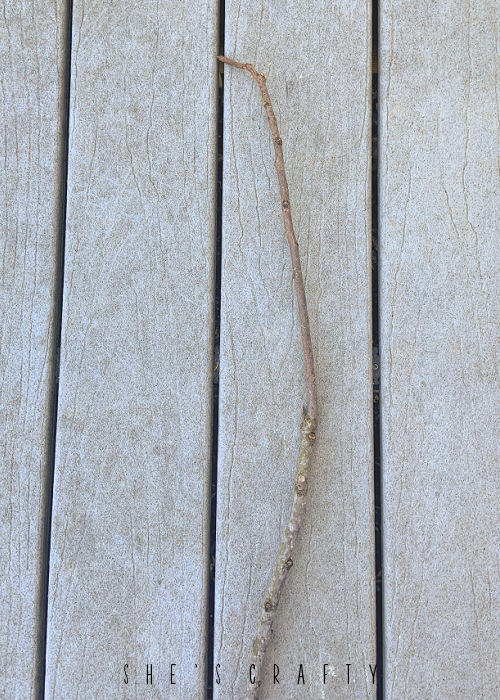
This screenshot has height=700, width=500. In order to click on cracks in the wood in this screenshot , I will do `click(41, 651)`, `click(215, 409)`, `click(56, 302)`, `click(61, 76)`, `click(218, 234)`, `click(219, 8)`, `click(381, 631)`, `click(381, 455)`, `click(371, 236)`, `click(378, 48)`.